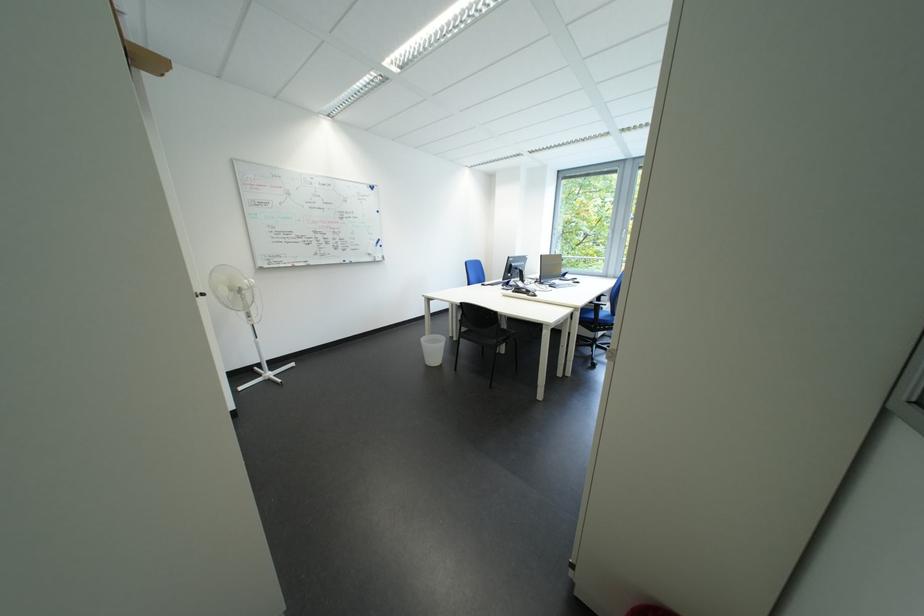
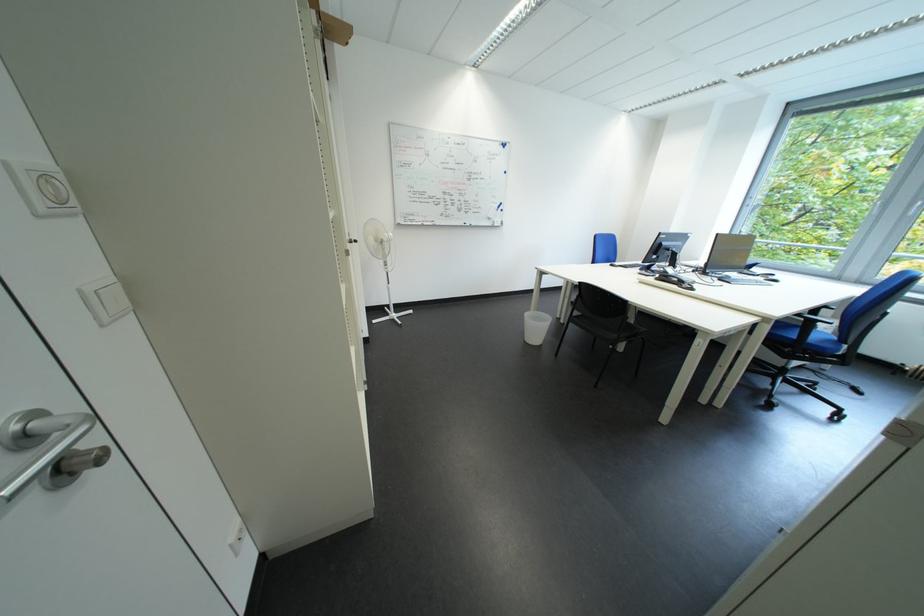
In the second image, find the point that corresponds to (x=435, y=342) in the first image.

(540, 317)